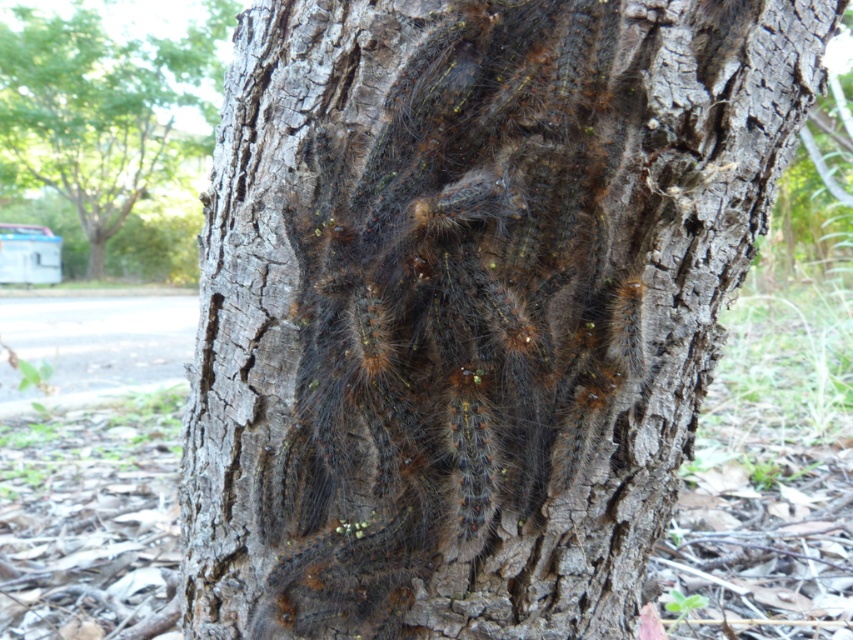
Can you confirm if fuzzy brown caterpillars at center is wider than brown fuzzy caterpillars at upper center?

Incorrect, fuzzy brown caterpillars at center's width does not surpass brown fuzzy caterpillars at upper center's.

Based on the photo, measure the distance between point (381, 122) and camera.

A distance of 38.92 inches exists between point (381, 122) and camera.

Which is in front, point (526, 99) or point (158, 163)?

Point (526, 99)

Where is `fuzzy brown caterpillars at center`? fuzzy brown caterpillars at center is located at coordinates point(457,314).